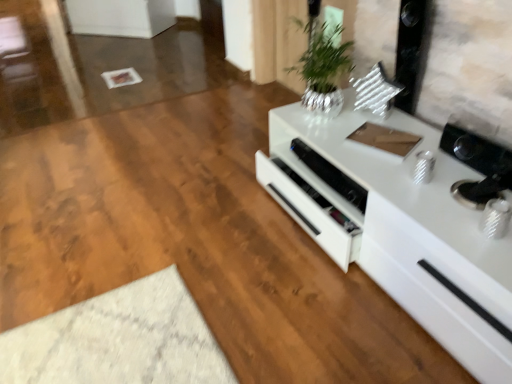
Question: Considering the relative sizes of white glossy speaker at center and white glossy cabinet at right in the image provided, is white glossy speaker at center wider than white glossy cabinet at right?

Choices:
 (A) no
 (B) yes

Answer: (A)

Question: Can you confirm if white glossy speaker at center is shorter than white glossy cabinet at right?

Choices:
 (A) no
 (B) yes

Answer: (B)

Question: Does white glossy speaker at center touch white glossy cabinet at right?

Choices:
 (A) no
 (B) yes

Answer: (A)

Question: Does white glossy speaker at center have a larger size compared to white glossy cabinet at right?

Choices:
 (A) yes
 (B) no

Answer: (B)

Question: Is white glossy speaker at center to the left of white glossy cabinet at right from the viewer's perspective?

Choices:
 (A) yes
 (B) no

Answer: (A)

Question: Is point (413, 311) closer or farther from the camera than point (322, 54)?

Choices:
 (A) closer
 (B) farther

Answer: (A)

Question: Considering the positions of white glossy cabinet at right and silver metallic vase at upper center in the image, is white glossy cabinet at right wider or thinner than silver metallic vase at upper center?

Choices:
 (A) thin
 (B) wide

Answer: (B)

Question: Based on their sizes in the image, would you say white glossy cabinet at right is bigger or smaller than silver metallic vase at upper center?

Choices:
 (A) big
 (B) small

Answer: (A)

Question: From a real-world perspective, relative to silver metallic vase at upper center, is white glossy cabinet at right vertically above or below?

Choices:
 (A) below
 (B) above

Answer: (A)

Question: From a real-world perspective, is silver metallic vase at upper center above or below white glossy speaker at center?

Choices:
 (A) below
 (B) above

Answer: (B)

Question: Is silver metallic vase at upper center inside the boundaries of white glossy speaker at center, or outside?

Choices:
 (A) inside
 (B) outside

Answer: (B)

Question: From their relative heights in the image, would you say silver metallic vase at upper center is taller or shorter than white glossy speaker at center?

Choices:
 (A) tall
 (B) short

Answer: (A)

Question: Looking at their shapes, would you say silver metallic vase at upper center is wider or thinner than white glossy speaker at center?

Choices:
 (A) wide
 (B) thin

Answer: (A)

Question: Considering the positions of point [338, 173] and point [465, 289], is point [338, 173] closer or farther from the camera than point [465, 289]?

Choices:
 (A) farther
 (B) closer

Answer: (A)

Question: Considering their positions, is white glossy speaker at center located in front of or behind white glossy cabinet at right?

Choices:
 (A) behind
 (B) front

Answer: (A)